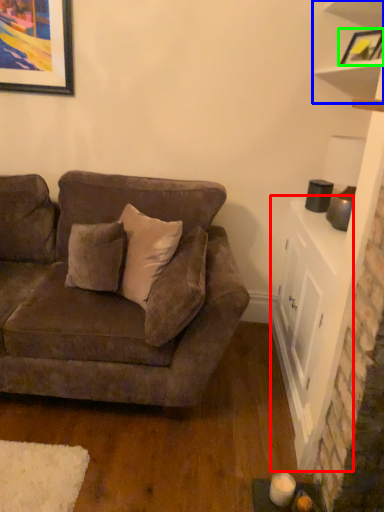
Question: Which object is positioned farthest from table (highlighted by a red box)? Select from shelf (highlighted by a blue box) and picture frame (highlighted by a green box).

Choices:
 (A) shelf
 (B) picture frame

Answer: (B)